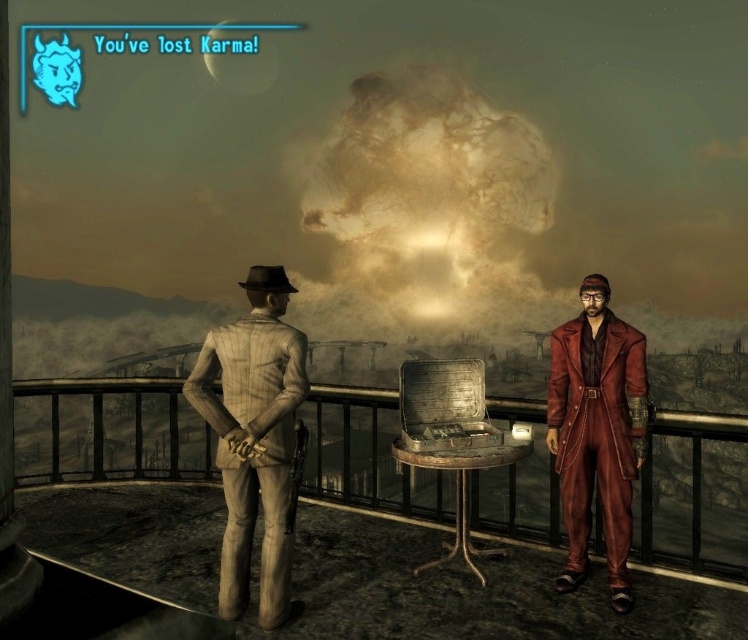
Question: Which of the following is the closest to the observer?

Choices:
 (A) light brown striped suit at left
 (B) leather coat at right

Answer: (A)

Question: Can you confirm if light brown striped suit at left is positioned above leather coat at right?

Choices:
 (A) no
 (B) yes

Answer: (B)

Question: Is light brown striped suit at left positioned at the back of leather coat at right?

Choices:
 (A) yes
 (B) no

Answer: (B)

Question: Can you confirm if light brown striped suit at left is smaller than leather coat at right?

Choices:
 (A) no
 (B) yes

Answer: (A)